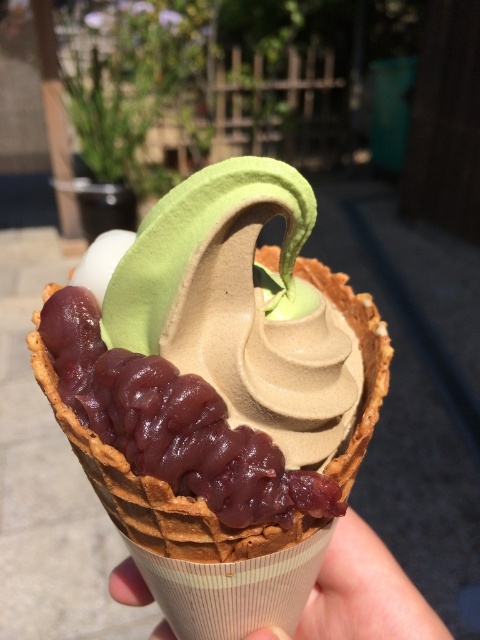
You are holding a ruler and want to measure the distance from your eyes to the point marked at coordinates point (240, 506) in the image of the waffle cone. Can you determine if this distance is more than 30 inches?

The distance between point (240, 506) and the camera is 31.71 inches, so yes, the distance is more than 30 inches.

You are holding a smooth chocolate ice cream cone at center and a smooth beige cone at center. Which one is nearer to your hand?

The smooth chocolate ice cream cone at center is closer to the viewer than smooth beige cone at center, so the smooth chocolate ice cream cone at center is nearer to your hand.

You are at an ice cream shop and see the smooth chocolate ice cream cone at center and the smooth beige cone at center. Which one has a greater width?

The smooth chocolate ice cream cone at center has a greater width than the smooth beige cone at center.